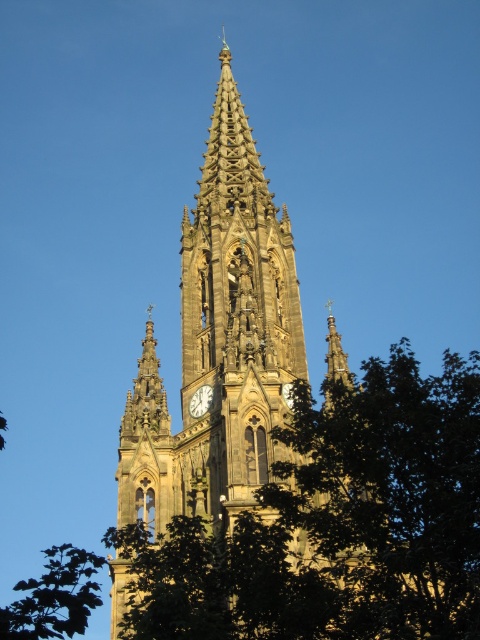
Question: Which point appears farthest from the camera in this image?

Choices:
 (A) (192, 397)
 (B) (381, 454)
 (C) (292, 280)
 (D) (78, 628)

Answer: (C)

Question: Is brown stone tower at center below white glossy clock at center?

Choices:
 (A) no
 (B) yes

Answer: (B)

Question: Can you confirm if green leafy tree at center is thinner than white glossy clock at center?

Choices:
 (A) no
 (B) yes

Answer: (A)

Question: Does brown stone tower at center appear on the left side of green leafy tree at lower left?

Choices:
 (A) yes
 (B) no

Answer: (B)

Question: Which object is positioned closest to the white glossy clock at center?

Choices:
 (A) green leafy tree at lower left
 (B) brown stone tower at center

Answer: (B)

Question: Which of the following is the closest to the observer?

Choices:
 (A) green leafy tree at lower left
 (B) white glossy clock at center

Answer: (A)